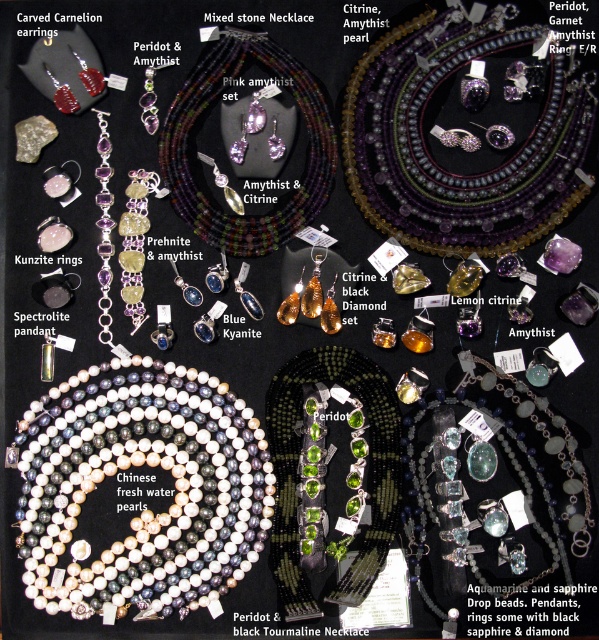
Does point (452, 60) come closer to viewer compared to point (556, 440)?

Yes.

Can you confirm if purple beaded necklace at upper center is taller than aquamarinesapphire drop beads at center?

Yes, purple beaded necklace at upper center is taller than aquamarinesapphire drop beads at center.

You are a GUI agent. You are given a task and a screenshot of the screen. Output one action in this format:
    pyautogui.click(x=<x>, y=<y>)
    Task: Click on the purple beaded necklace at upper center
    Image resolution: width=599 pixels, height=640 pixels.
    Given the screenshot: What is the action you would take?
    pyautogui.click(x=455, y=147)

Who is positioned more to the right, purple beaded necklace at upper center or mixed stonematerial/texturenecklace at upper center?

purple beaded necklace at upper center is more to the right.

Does purple beaded necklace at upper center come behind mixed stonematerial/texturenecklace at upper center?

No, purple beaded necklace at upper center is closer to the viewer.

What are the coordinates of `purple beaded necklace at upper center` in the screenshot? It's located at (455, 147).

Does mixed stonematerial/texturenecklace at upper center appear over aquamarinesapphire drop beads at center?

Indeed, mixed stonematerial/texturenecklace at upper center is positioned over aquamarinesapphire drop beads at center.

Can you confirm if mixed stonematerial/texturenecklace at upper center is positioned below aquamarinesapphire drop beads at center?

Incorrect, mixed stonematerial/texturenecklace at upper center is not positioned below aquamarinesapphire drop beads at center.

Does point (301, 92) lie behind point (506, 374)?

No, it is not.

Locate an element on the screen. Image resolution: width=599 pixels, height=640 pixels. mixed stonematerial/texturenecklace at upper center is located at coordinates (201, 112).